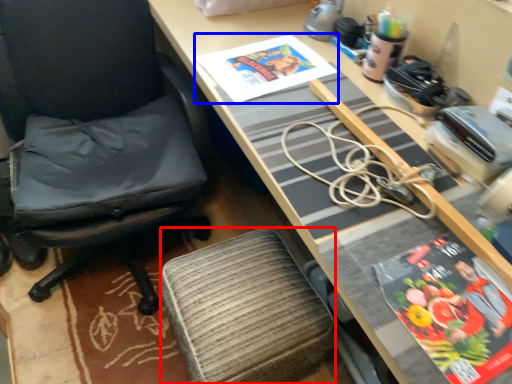
Question: Which object is further to the camera taking this photo, stool (highlighted by a red box) or book cover (highlighted by a blue box)?

Choices:
 (A) stool
 (B) book cover

Answer: (B)